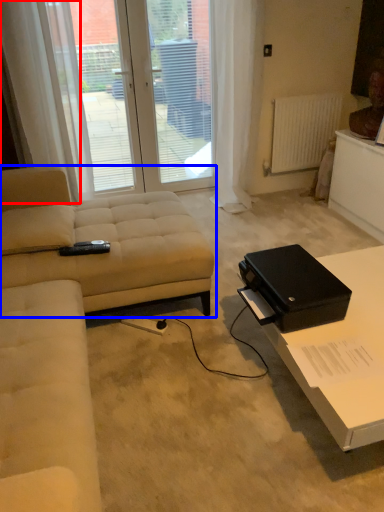
Question: Which of the following is the closest to the observer, curtain (highlighted by a red box) or studio couch (highlighted by a blue box)?

Choices:
 (A) curtain
 (B) studio couch

Answer: (B)